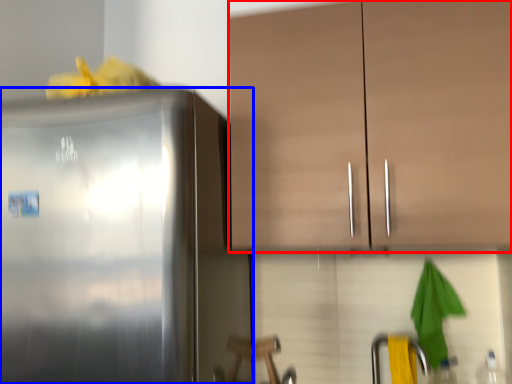
Question: Among these objects, which one is nearest to the camera, cabinetry (highlighted by a red box) or refrigerator (highlighted by a blue box)?

Choices:
 (A) cabinetry
 (B) refrigerator

Answer: (B)